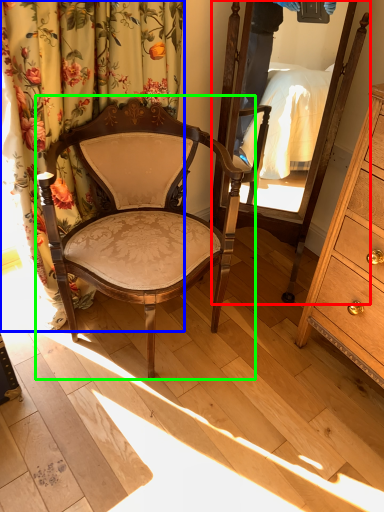
Question: Estimate the real-world distances between objects in this image. Which object is farther from mirror (highlighted by a red box), curtain (highlighted by a blue box) or chair (highlighted by a green box)?

Choices:
 (A) curtain
 (B) chair

Answer: (A)